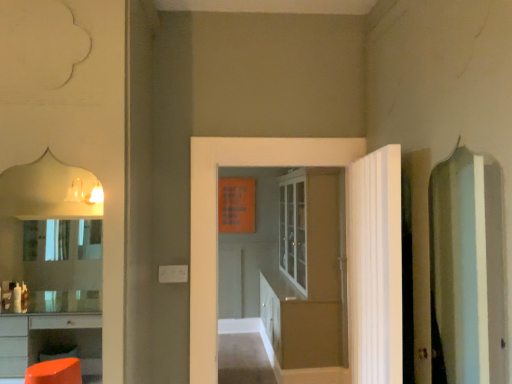
Question: Which direction should I rotate to look at matte glass cabinet at center, which is counted as the 1th door, starting from the back, — up or down?

Choices:
 (A) down
 (B) up

Answer: (A)

Question: From a real-world perspective, is white glossy door at center, acting as the second door starting from the front, physically above matte glass cabinet at center, which is counted as the 1th door, starting from the back?

Choices:
 (A) no
 (B) yes

Answer: (B)

Question: Is white glossy door at center, acting as the second door starting from the front, smaller than matte glass cabinet at center, which is counted as the 1th door, starting from the back?

Choices:
 (A) yes
 (B) no

Answer: (A)

Question: From the image's perspective, is white glossy door at center, acting as the second door starting from the front, located above matte glass cabinet at center, which is counted as the 1th door, starting from the back?

Choices:
 (A) yes
 (B) no

Answer: (A)

Question: Is white glossy door at center, acting as the second door starting from the front, further to the viewer compared to matte glass cabinet at center, which is counted as the 1th door, starting from the back?

Choices:
 (A) no
 (B) yes

Answer: (A)

Question: Does white glossy door at center, acting as the second door starting from the front, have a larger size compared to matte glass cabinet at center, which is the 3th door from front to back?

Choices:
 (A) no
 (B) yes

Answer: (A)

Question: Is white glossy door at center, acting as the second door starting from the front, positioned with its back to matte glass cabinet at center, which is counted as the 1th door, starting from the back?

Choices:
 (A) yes
 (B) no

Answer: (A)

Question: Is white textured door at right, placed as the first door when sorted from front to back, behind matte glass cabinet at center, which is counted as the 1th door, starting from the back?

Choices:
 (A) yes
 (B) no

Answer: (B)

Question: Would you say white textured door at right, placed as the first door when sorted from front to back, contains matte glass cabinet at center, which is the 3th door from front to back?

Choices:
 (A) no
 (B) yes

Answer: (A)

Question: Is white textured door at right, positioned as the third door in back-to-front order, aimed at matte glass cabinet at center, which is the 3th door from front to back?

Choices:
 (A) no
 (B) yes

Answer: (A)

Question: Considering the relative positions of white textured door at right, placed as the first door when sorted from front to back, and matte glass cabinet at center, which is the 3th door from front to back, in the image provided, is white textured door at right, placed as the first door when sorted from front to back, to the right of matte glass cabinet at center, which is the 3th door from front to back, from the viewer's perspective?

Choices:
 (A) no
 (B) yes

Answer: (B)

Question: Is the depth of white textured door at right, placed as the first door when sorted from front to back, less than that of matte glass cabinet at center, which is the 3th door from front to back?

Choices:
 (A) yes
 (B) no

Answer: (A)

Question: From a real-world perspective, is white textured door at right, positioned as the third door in back-to-front order, on matte glass cabinet at center, which is counted as the 1th door, starting from the back?

Choices:
 (A) yes
 (B) no

Answer: (A)

Question: Is white glossy door at center, acting as the second door starting from the front, at the back of white textured door at right, placed as the first door when sorted from front to back?

Choices:
 (A) no
 (B) yes

Answer: (A)